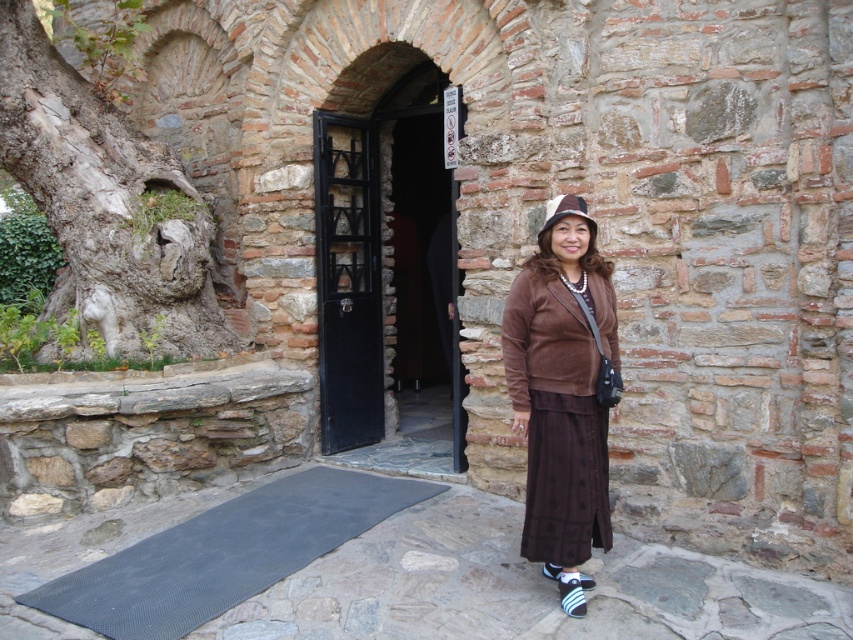
You are standing in front of the stone structure with the woman. You want to take a photo of the archway. The camera is at your eye level. Which of the two points, point (590, 448) or point (561, 204), is closer to you?

Point (590, 448) is closer to the viewer than point (561, 204).

You are a tour guide leading a group to the entrance of the stone structure. You notice a black wooden door at center and a brown felt hat at center. Which object is closer to the group if they are standing at the starting point?

The black wooden door at center is 7.15 feet away from the brown felt hat at center. Since the group is at the starting point, the closer object would depend on their exact position, but based on the given distance, the black wooden door is 7.15 feet away from the hat. Without additional information on their position, we can only state the distance between them.

You are a fashion designer observing the woman in the scene. You need to create a new outfit that maintains the same color scheme but adjusts the vertical spacing between the skirt and hat. If the current vertical distance between the brown suede skirt at center and brown felt hat at center is 29.11 inches, what is the minimum vertical adjustment needed to ensure the hat sits closer to the skirt without overlapping?

The minimum vertical adjustment needed is to reduce the distance between the brown suede skirt at center and brown felt hat at center by just over 0 inches, as the hat can be moved downward by any amount greater than 0 inches to sit closer to the skirt without overlapping. However, since overlapping is not allowed, the hat must remain at least 0.01 inches away. Therefore, the minimum adjustment is a reduction of 29.1 inches to bring the hat to 0.1 inches above the skirt.